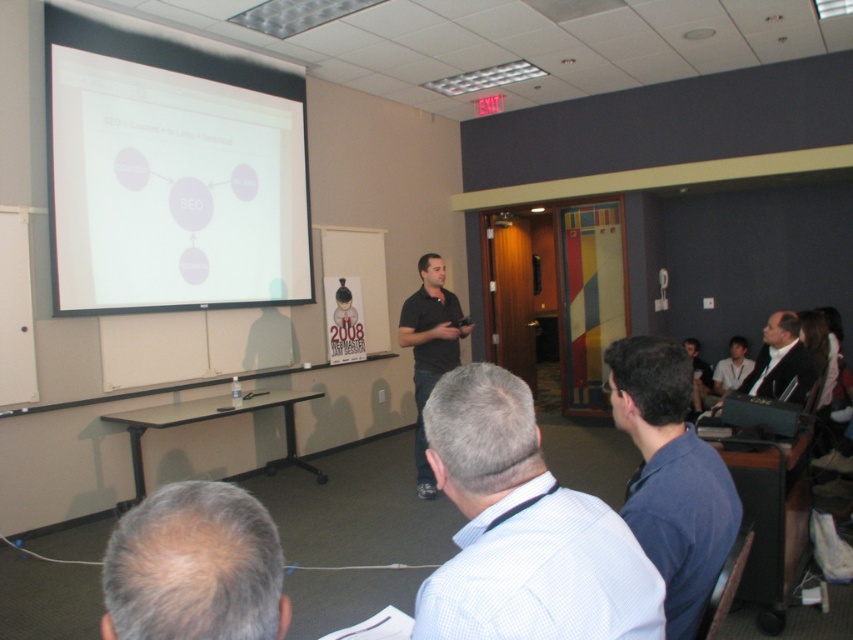
Between black shirt at center and black plastic projector at upper left, which one is positioned higher?

black shirt at center is higher up.

Between point (415, 397) and point (752, 397), which one is positioned in front?

Positioned in front is point (752, 397).

You are a GUI agent. You are given a task and a screenshot of the screen. Output one action in this format:
    pyautogui.click(x=<x>, y=<y>)
    Task: Click on the black shirt at center
    The image size is (853, 640).
    Given the screenshot: What is the action you would take?
    pyautogui.click(x=430, y=348)

Can you confirm if dark suit jacket at upper right is smaller than black plastic projector at upper left?

No.

Is dark suit jacket at upper right shorter than black plastic projector at upper left?

No, dark suit jacket at upper right is not shorter than black plastic projector at upper left.

The height and width of the screenshot is (640, 853). I want to click on dark suit jacket at upper right, so click(x=780, y=362).

The width and height of the screenshot is (853, 640). In order to click on dark suit jacket at upper right in this screenshot , I will do `click(780, 362)`.

Which is below, white checkered shirt at center or blue shirt at lower right?

Positioned lower is blue shirt at lower right.

Which is above, white checkered shirt at center or blue shirt at lower right?

Positioned higher is white checkered shirt at center.

Is point (456, 416) in front of point (627, 385)?

Yes, point (456, 416) is closer to viewer.

This screenshot has width=853, height=640. What are the coordinates of `white checkered shirt at center` in the screenshot? It's located at (523, 531).